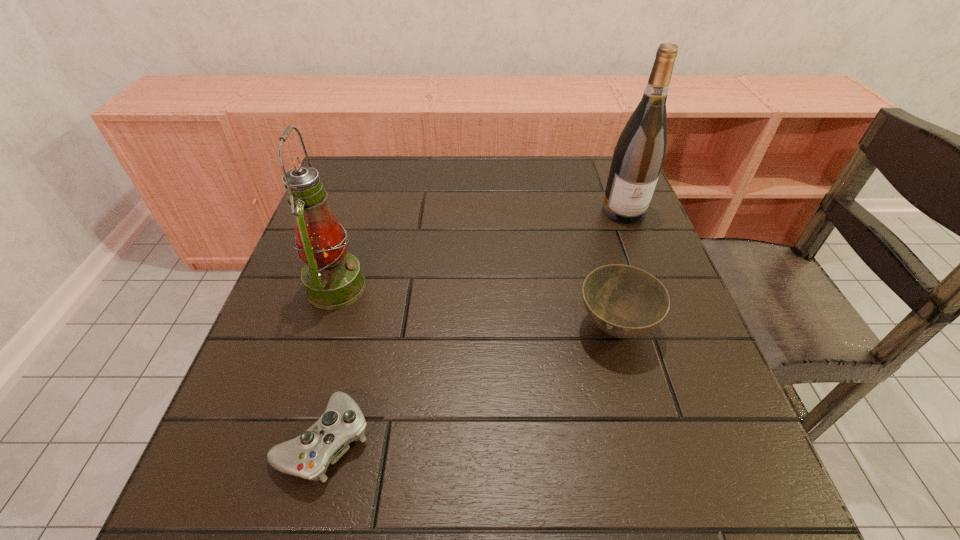
The width and height of the screenshot is (960, 540). I want to click on blank space at the right edge of the desktop, so coord(719,454).

I want to click on vacant space at the far left corner, so click(x=338, y=176).

In the image, there is a desktop. What are the coordinates of `vacant space at the near left corner` in the screenshot? It's located at (302, 480).

The height and width of the screenshot is (540, 960). Find the location of `vacant space at the far right corner`. vacant space at the far right corner is located at coordinates (588, 188).

Locate an element on the screen. This screenshot has width=960, height=540. blank space at the near right corner is located at coordinates (734, 471).

In order to click on vacant space that is in between the shortest object and the oil lamp in this screenshot , I will do (330, 364).

Find the location of a particular element. This screenshot has width=960, height=540. vacant area between the oil lamp and the nearest object is located at coordinates (330, 364).

Find the location of a particular element. empty space between the oil lamp and the third tallest object is located at coordinates (475, 307).

The height and width of the screenshot is (540, 960). Identify the location of free space between the control and the oil lamp. [330, 364].

The image size is (960, 540). Identify the location of vacant space that's between the nearest object and the farthest object. (473, 326).